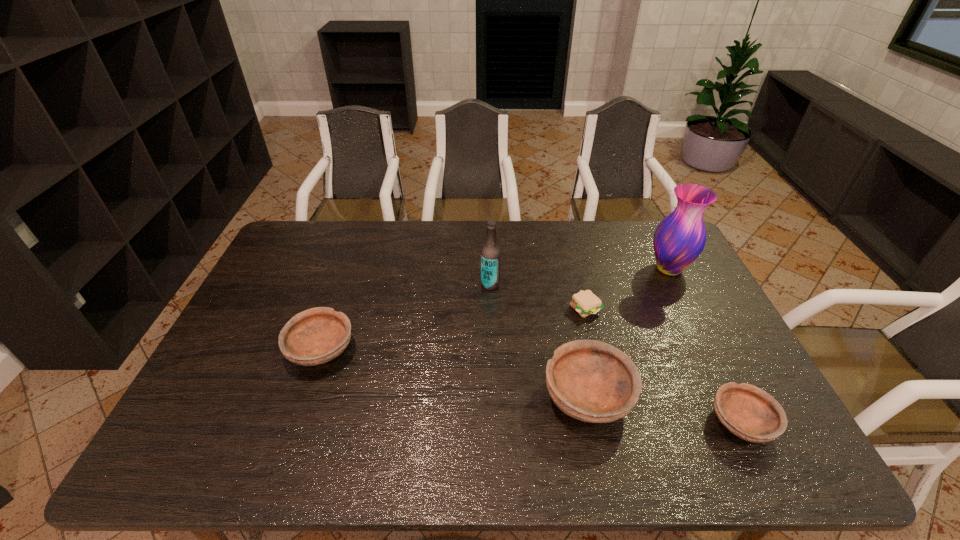
Identify the location of bowl at the right edge. This screenshot has height=540, width=960. (750, 413).

You are a GUI agent. You are given a task and a screenshot of the screen. Output one action in this format:
    pyautogui.click(x=<x>, y=<y>)
    Task: Click on the vase that is at the right edge
    
    Given the screenshot: What is the action you would take?
    pyautogui.click(x=679, y=239)

Identify the location of object at the far right corner. (679, 239).

This screenshot has width=960, height=540. I want to click on object present at the near right corner, so click(750, 413).

In the image, there is a desktop. Where is `free region at the far edge`? The height and width of the screenshot is (540, 960). free region at the far edge is located at coordinates coord(619,233).

I want to click on vacant space at the left edge of the desktop, so click(x=232, y=376).

Locate an element on the screen. The width and height of the screenshot is (960, 540). blank space at the right edge of the desktop is located at coordinates (662, 308).

Locate an element on the screen. This screenshot has height=540, width=960. vacant point located between the tallest object and the leftmost object is located at coordinates (495, 309).

Image resolution: width=960 pixels, height=540 pixels. Identify the location of free space between the shortest bowl and the fourth shortest object. (664, 409).

The width and height of the screenshot is (960, 540). Find the location of `vacant space that's between the patty and the second tallest bowl`. vacant space that's between the patty and the second tallest bowl is located at coordinates (453, 329).